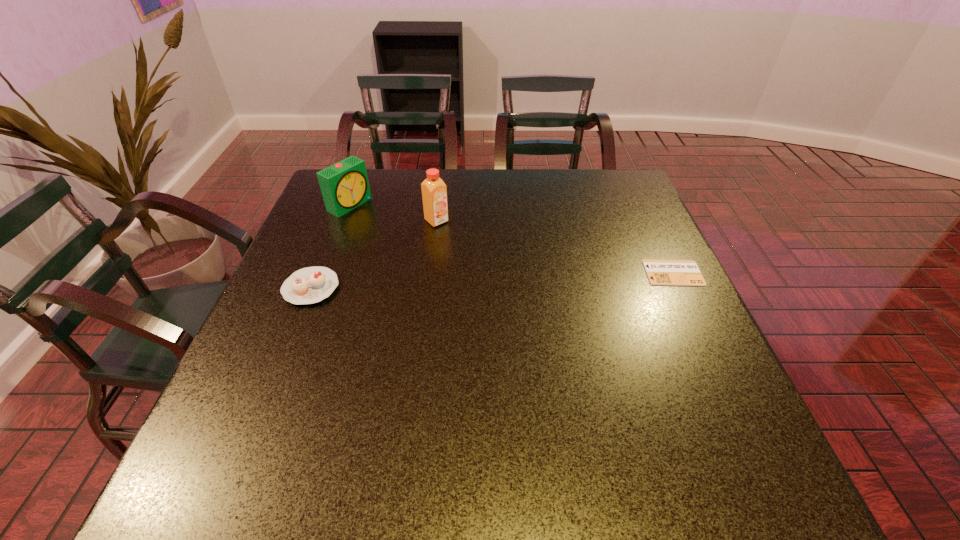
Locate an element on the screen. The height and width of the screenshot is (540, 960). vacant region at the near edge of the desktop is located at coordinates (469, 420).

Identify the location of free spot at the left edge of the desktop. (330, 268).

In the image, there is a desktop. Identify the location of vacant space at the right edge. (640, 315).

You are a GUI agent. You are given a task and a screenshot of the screen. Output one action in this format:
    pyautogui.click(x=<x>, y=<y>)
    Task: Click on the vacant space at the near right corner of the desktop
    
    Given the screenshot: What is the action you would take?
    pyautogui.click(x=738, y=416)

Locate an element on the screen. This screenshot has height=540, width=960. free space between the cupcake and the alarm clock is located at coordinates (330, 246).

Locate an element on the screen. The height and width of the screenshot is (540, 960). vacant point located between the rightmost object and the third shortest object is located at coordinates (512, 239).

Identify the location of vacant point located between the rightmost object and the orange juice. The height and width of the screenshot is (540, 960). (555, 247).

Locate an element on the screen. free space between the orange juice and the shortest object is located at coordinates (555, 247).

Locate an element on the screen. This screenshot has height=540, width=960. empty space that is in between the second shortest object and the alarm clock is located at coordinates (330, 246).

Where is `vacant region between the alarm clock and the third object from left to right`? The height and width of the screenshot is (540, 960). vacant region between the alarm clock and the third object from left to right is located at coordinates (393, 213).